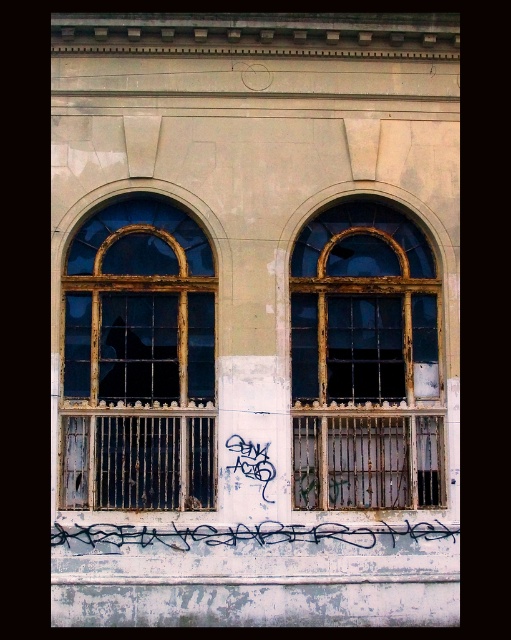
Question: Can you confirm if rusty metal window at left is positioned to the right of rusty metal window at center?

Choices:
 (A) yes
 (B) no

Answer: (B)

Question: Which point is farther to the camera?

Choices:
 (A) (406, 268)
 (B) (159, 529)

Answer: (A)

Question: Is rusty metal window at left to the right of black graffiti at center from the viewer's perspective?

Choices:
 (A) yes
 (B) no

Answer: (B)

Question: Which object is the closest to the black graffiti at center?

Choices:
 (A) rusty metal window at left
 (B) rusty metal window at center

Answer: (B)

Question: Does rusty metal window at left appear on the right side of black graffiti at center?

Choices:
 (A) yes
 (B) no

Answer: (B)

Question: Among these objects, which one is farthest from the camera?

Choices:
 (A) rusty metal window at left
 (B) rusty metal window at center

Answer: (B)